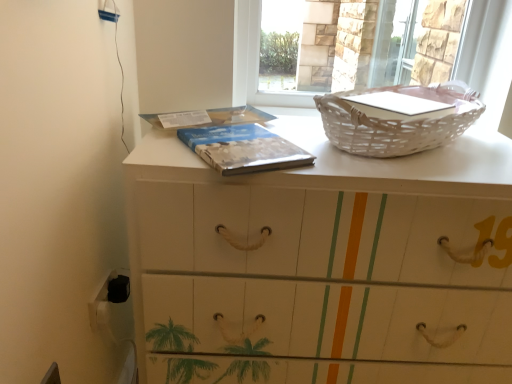
Locate an element on the screen. The height and width of the screenshot is (384, 512). vacant region to the right of blue textured book at center is located at coordinates (337, 153).